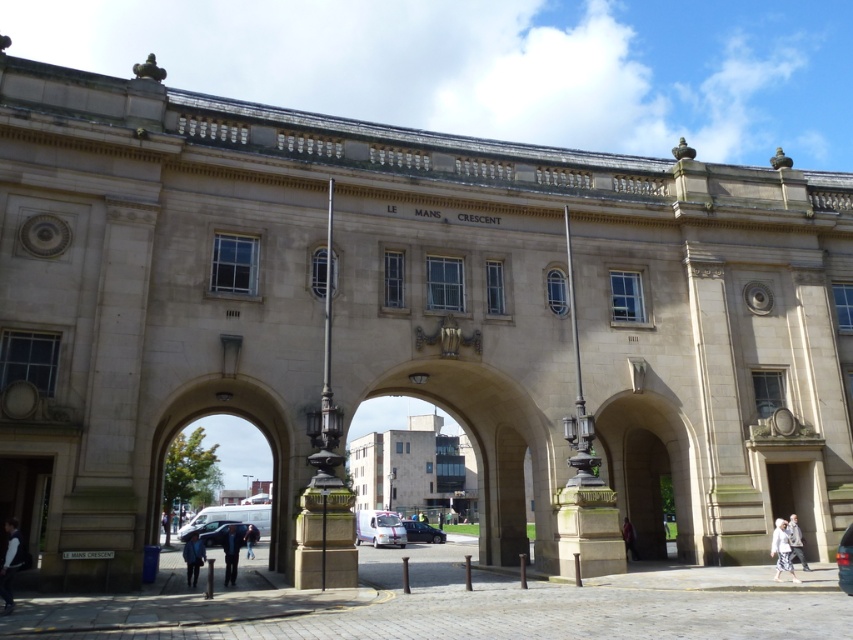
You are standing at the entrance of Le Mans Crescent and notice two items at the lower right corner of the scene. Which one is located more to the left between the white cotton shirt at lower right and the white fabric at lower right?

The white cotton shirt at lower right is positioned on the left side of the white fabric at lower right, so it is more to the left.

You are standing at the entrance of Le Mans Crescent and notice two points marked on the building facade. The first point is at coordinates point (408, 474) and the second is at point (19, 538). Which point is closer to you?

Point (408, 474) is closer to you because it is further to the viewer than point (19, 538).

You are standing at the entrance of Le Mans Crescent and notice the matte stone archway at center and the white fabric at lower right. Which object is bigger in size?

The matte stone archway at center has a larger size compared to the white fabric at lower right.